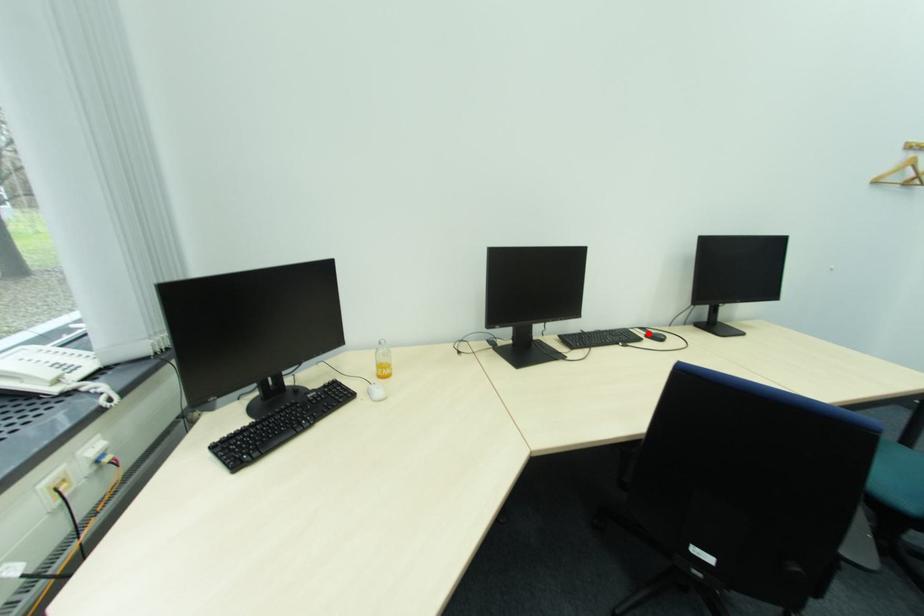
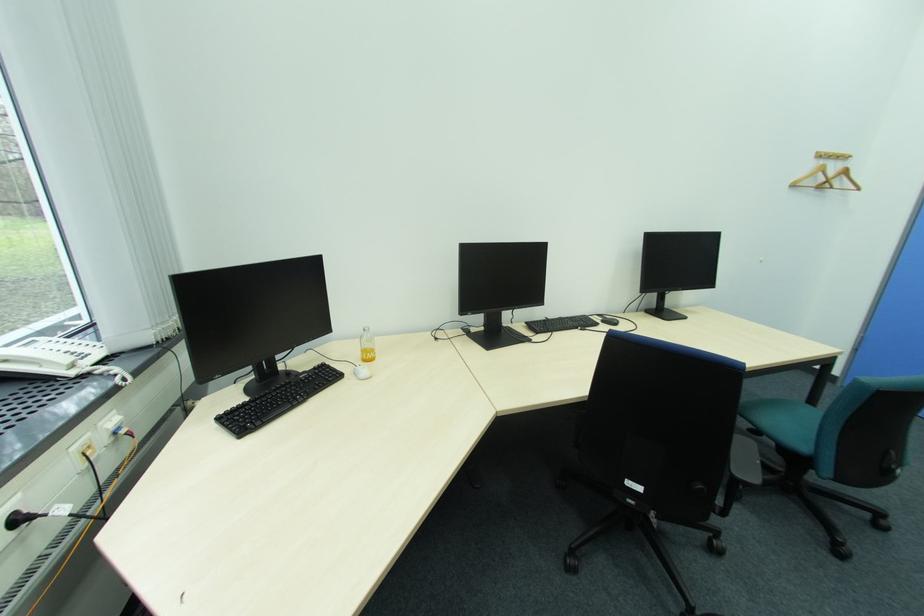
Locate, in the second image, the point that corresponds to the highlighted location in the first image.

(604, 320)